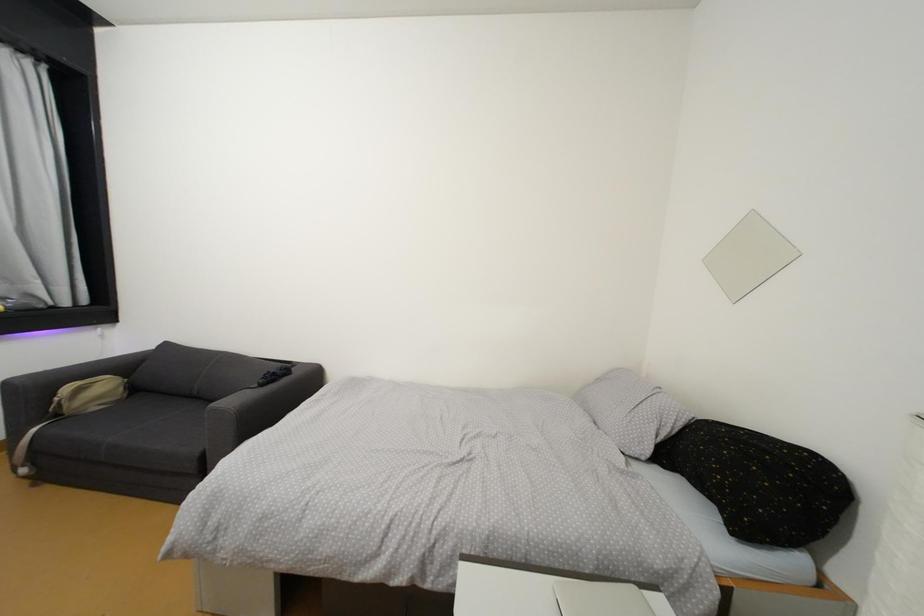
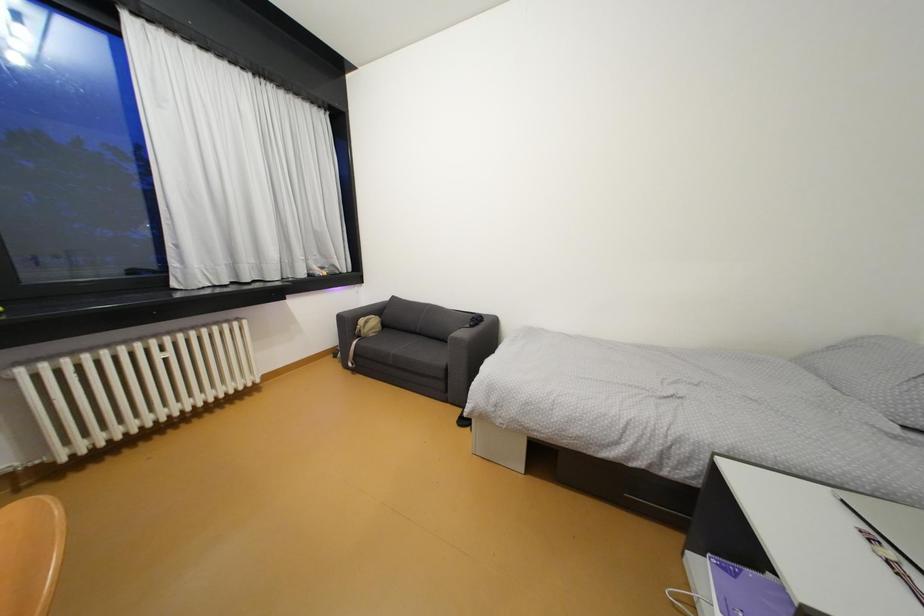
What movement of the cameraman would produce the second image?

The cameraman walked toward left, backward.